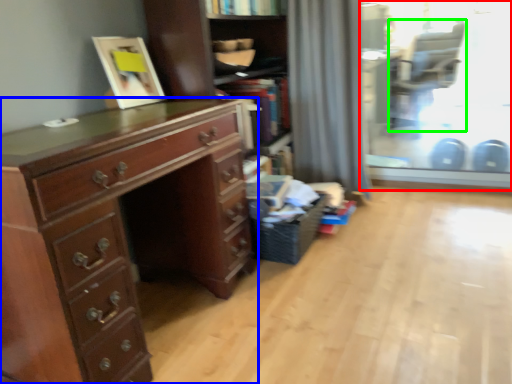
Question: Which object is the farthest from glass door (highlighted by a red box)? Choose among these: chest of drawers (highlighted by a blue box) or armchair (highlighted by a green box).

Choices:
 (A) chest of drawers
 (B) armchair

Answer: (A)